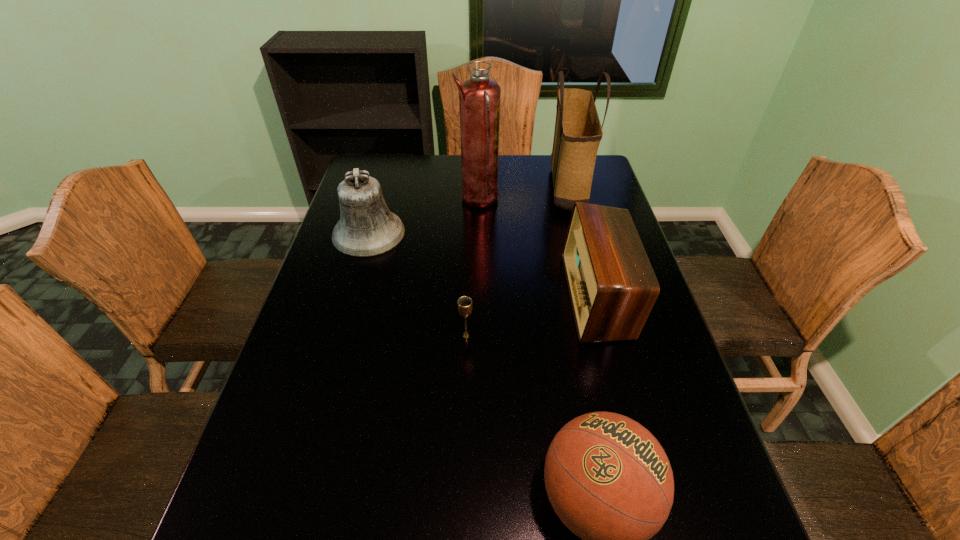
Find the location of a particular element. The width and height of the screenshot is (960, 540). fire extinguisher is located at coordinates (479, 97).

This screenshot has height=540, width=960. What are the coordinates of `tote bag` in the screenshot? It's located at (578, 132).

Locate an element on the screen. bell is located at coordinates (366, 228).

Identify the location of radio receiver. (612, 286).

I want to click on the shortest object, so click(x=464, y=304).

What are the coordinates of `free region located 0.190m on the side of the fire extinguisher with the label` in the screenshot? It's located at (555, 201).

Locate an element on the screen. The height and width of the screenshot is (540, 960). vacant space located on the front of the tote bag is located at coordinates (587, 259).

Locate an element on the screen. Image resolution: width=960 pixels, height=540 pixels. free space located 0.320m on the back of the bell is located at coordinates (390, 163).

Image resolution: width=960 pixels, height=540 pixels. Identify the location of free space located 0.070m on the front-facing side of the radio receiver. (542, 296).

Locate an element on the screen. This screenshot has height=540, width=960. vacant area situated on the front-facing side of the radio receiver is located at coordinates (528, 296).